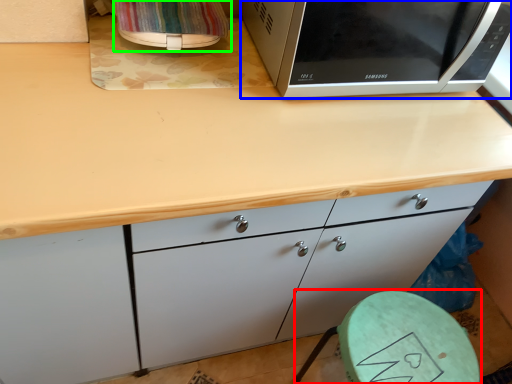
Question: Which object is positioned closest to round table (highlighted by a red box)? Select from microwave oven (highlighted by a blue box) and appliance (highlighted by a green box).

Choices:
 (A) microwave oven
 (B) appliance

Answer: (A)